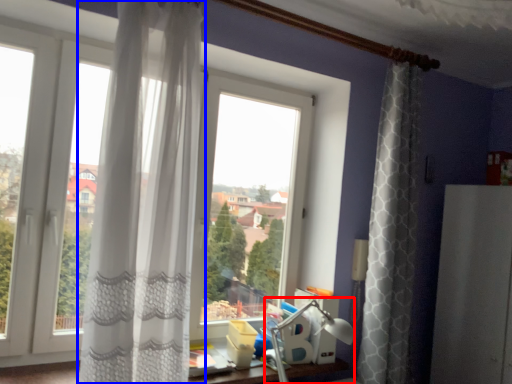
Question: Which point is closer to the camera, table lamp (highlighted by a red box) or curtain (highlighted by a blue box)?

Choices:
 (A) table lamp
 (B) curtain

Answer: (B)